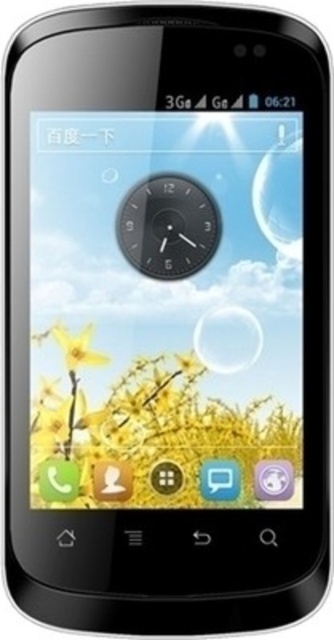
You are holding the smartphone and want to check the time. Which object on the screen will you look at first, the black matte clock at center or the transparent glass bubble at center?

The black matte clock at center has a larger size compared to the transparent glass bubble at center, so you will look at the black matte clock at center first.